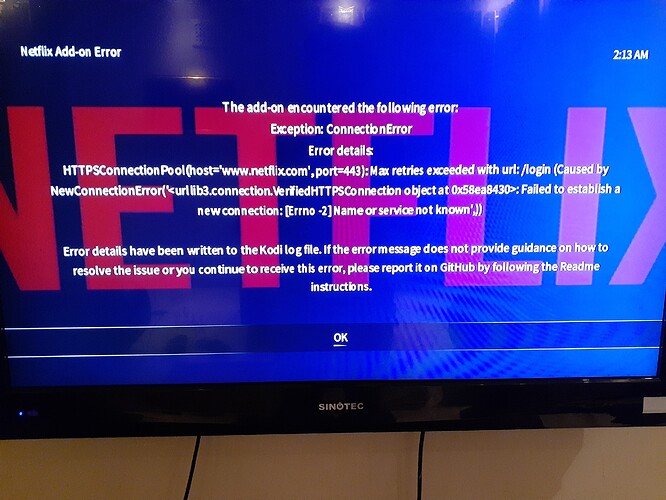
Locate an element on the screen. Image resolution: width=666 pixels, height=500 pixels. tile is located at coordinates (178, 459), (292, 473), (498, 459).